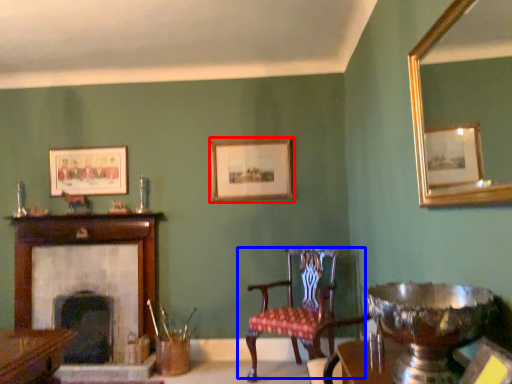
Question: Among these objects, which one is nearest to the camera, picture frame (highlighted by a red box) or chair (highlighted by a blue box)?

Choices:
 (A) picture frame
 (B) chair

Answer: (B)